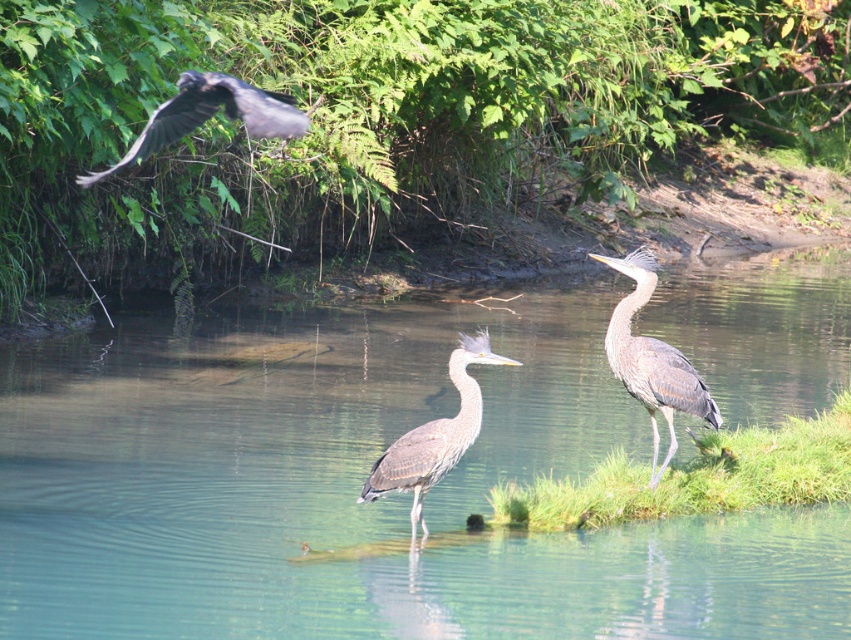
Question: Which object is the farthest from the gray-brown feathered heron at center-right?

Choices:
 (A) gray feathered crow at upper left
 (B) gray feathered heron at center
 (C) clear water at center

Answer: (C)

Question: Does clear water at center appear over gray-brown feathered heron at center-right?

Choices:
 (A) no
 (B) yes

Answer: (A)

Question: Which point is closer to the camera?

Choices:
 (A) gray feathered heron at center
 (B) clear water at center
 (C) gray feathered crow at upper left

Answer: (B)

Question: Which object is the closest to the gray-brown feathered heron at center-right?

Choices:
 (A) gray feathered crow at upper left
 (B) gray feathered heron at center
 (C) clear water at center

Answer: (B)

Question: Does clear water at center have a lesser width compared to gray-brown feathered heron at center-right?

Choices:
 (A) yes
 (B) no

Answer: (B)

Question: Is gray-brown feathered heron at center-right positioned before gray feathered heron at center?

Choices:
 (A) yes
 (B) no

Answer: (B)